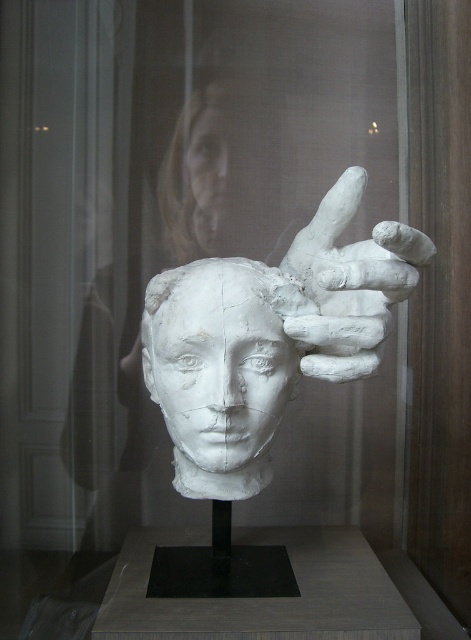
You are standing in front of the sculpture in the glass case. You notice two points marked on the sculpture. The first point is at coordinates point (240, 305), and the second point is at point (216, 106). Which of these two points appears closer to you?

Point (240, 305) is closer to the camera than point (216, 106), so the first point appears closer to you.

You are a museum curator planning to display a new sculpture. The sculpture has a white clay hand at upper center and a smooth skin face at upper center. You need to ensure that the hand is visible from a distance. Given their sizes, which object should you focus the lighting on to highlight its prominence?

The white clay hand at upper center is larger than the smooth skin face at upper center, so focusing the lighting on the white clay hand at upper center will better highlight its prominence due to its larger size.

You are a museum visitor observing the sculpture through the glass case. The sculpture has a white clay hand at upper center and a white clay head at upper center. From your perspective, which object is positioned to the right side?

The white clay hand at upper center is positioned to the right of the white clay head at upper center.